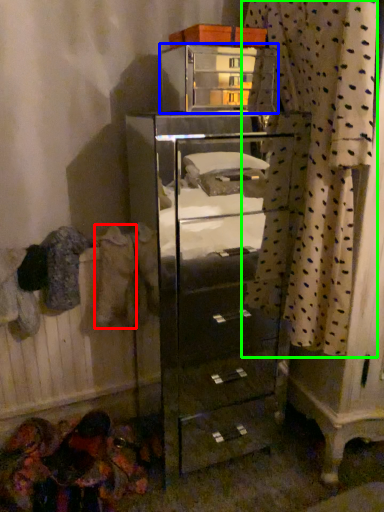
Question: Which is nearer to the clothing (highlighted by a red box)? furniture (highlighted by a blue box) or curtain (highlighted by a green box).

Choices:
 (A) furniture
 (B) curtain

Answer: (B)